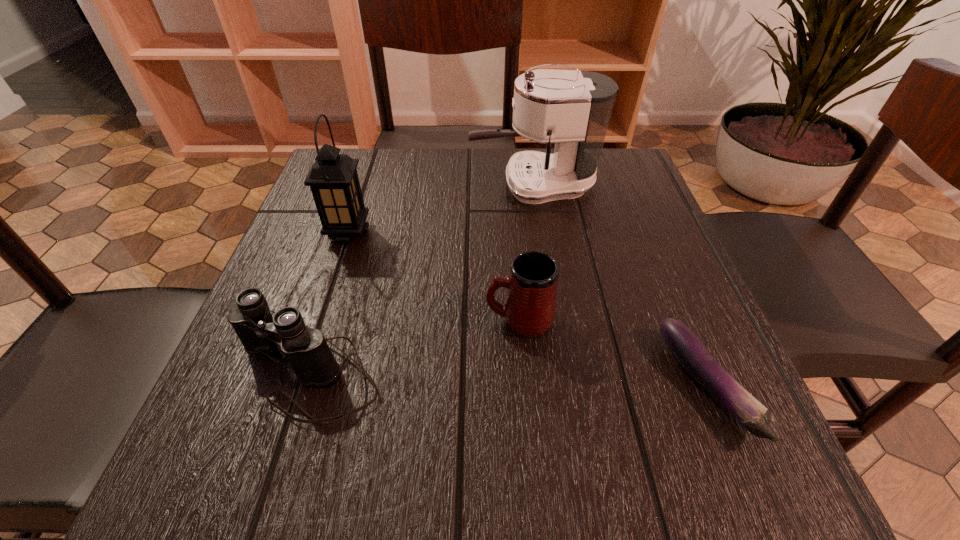
Locate an element on the screen. The image size is (960, 540). free region located on the side of the mug with the handle is located at coordinates (347, 319).

Identify the location of vacant space situated on the side of the mug with the handle. (262, 319).

In order to click on vacant space positioned on the side of the mug with the handle in this screenshot , I will do `click(329, 319)`.

You are a GUI agent. You are given a task and a screenshot of the screen. Output one action in this format:
    pyautogui.click(x=<x>, y=<y>)
    Task: Click on the vacant space located 0.200m on the back of the binoculars
    
    Given the screenshot: What is the action you would take?
    pyautogui.click(x=348, y=247)

Identify the location of vacant space located on the back of the eggplant. (626, 191).

You are a GUI agent. You are given a task and a screenshot of the screen. Output one action in this format:
    pyautogui.click(x=<x>, y=<y>)
    Task: Click on the object present at the far edge
    This screenshot has height=540, width=960.
    Given the screenshot: What is the action you would take?
    pyautogui.click(x=571, y=108)

I want to click on object that is at the near edge, so click(x=690, y=352).

Where is `lantern at the left edge`? lantern at the left edge is located at coordinates (333, 179).

The width and height of the screenshot is (960, 540). What are the coordinates of `binoculars that is at the left edge` in the screenshot? It's located at (306, 353).

The height and width of the screenshot is (540, 960). What are the coordinates of `coffee maker at the right edge` in the screenshot? It's located at (571, 108).